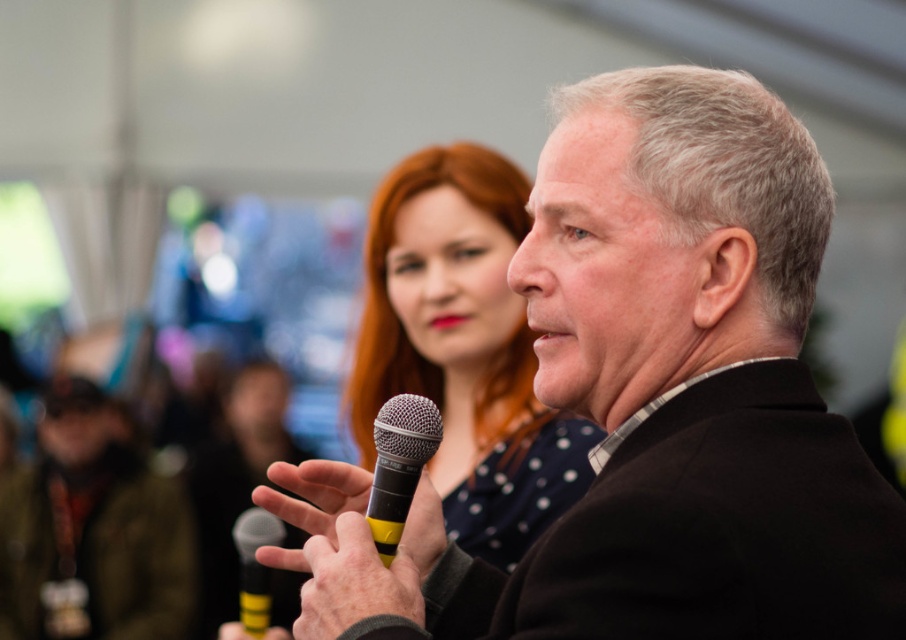
Can you confirm if black matte suit at center is positioned below black matte microphone at center?

Actually, black matte suit at center is above black matte microphone at center.

Does black matte suit at center have a lesser width compared to black matte microphone at center?

Incorrect, black matte suit at center's width is not less than black matte microphone at center's.

Find the location of a particular element. The image size is (906, 640). black matte suit at center is located at coordinates (651, 401).

Can you confirm if silver metallic microphone at center is thinner than black matte microphone at center?

Indeed, silver metallic microphone at center has a lesser width compared to black matte microphone at center.

Is point (434, 445) farther from viewer compared to point (262, 529)?

That is False.

Find the location of `silver metallic microphone at center`. silver metallic microphone at center is located at coordinates (400, 465).

Can you confirm if black matte suit at center is positioned to the left of polka dot fabric dress at center?

No, black matte suit at center is not to the left of polka dot fabric dress at center.

Is black matte suit at center closer to camera compared to polka dot fabric dress at center?

Yes, it is.

Does point (769, 384) lie in front of point (419, 150)?

That is True.

You are a GUI agent. You are given a task and a screenshot of the screen. Output one action in this format:
    pyautogui.click(x=<x>, y=<y>)
    Task: Click on the black matte suit at center
    The image size is (906, 640).
    Given the screenshot: What is the action you would take?
    pyautogui.click(x=651, y=401)